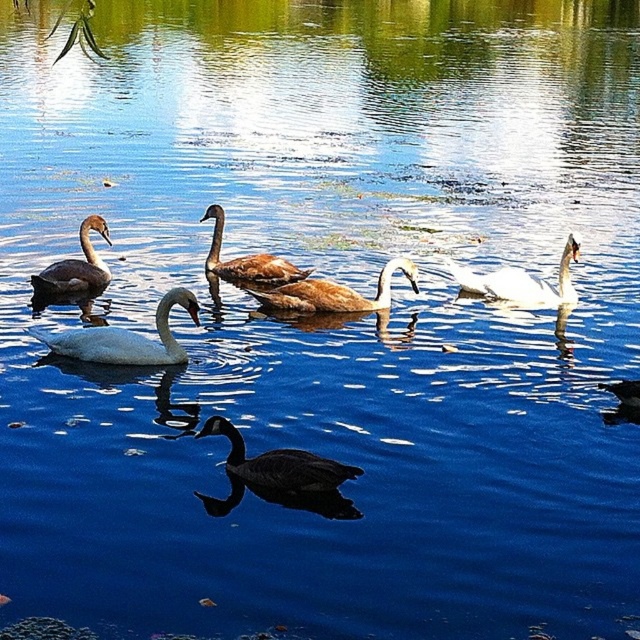
You are a photographer trying to capture a closeup shot of the white glossy swan at center and the brown matte swan at center. If your camera can only focus on objects within a 1.2 meter width, can you fit both swans in the frame without zooming in?

The white glossy swan at center is narrower than the brown matte swan at center. Since the camera can focus on objects within a 1.2 meter width, but the combined width of both swans may exceed this limit depending on their exact sizes. However, the description only specifies the white swan is narrower than the brown one, but does not provide their exact widths. Therefore, it is uncertain if both can fit within the 1.2 meter frame without additional information.

Based on the photo, you are a photographer trying to capture the white glossy swan at center and the brown matte swan at left in a single shot. Given that your camera can only focus on one subject at a time, which swan should you choose to ensure the larger one is in focus?

The white glossy swan at center is larger than the brown matte swan at left, so you should focus on the white glossy swan at center to ensure the larger one is in focus.

You are standing on the lakeside and see the white glossy swan at center and the brown matte swan at left. If you want to approach the swan that is closer to your left side, which one should you go to?

The brown matte swan at left is to the left of the white glossy swan at center, so it is closer to your left side. Approach the brown matte swan at left.